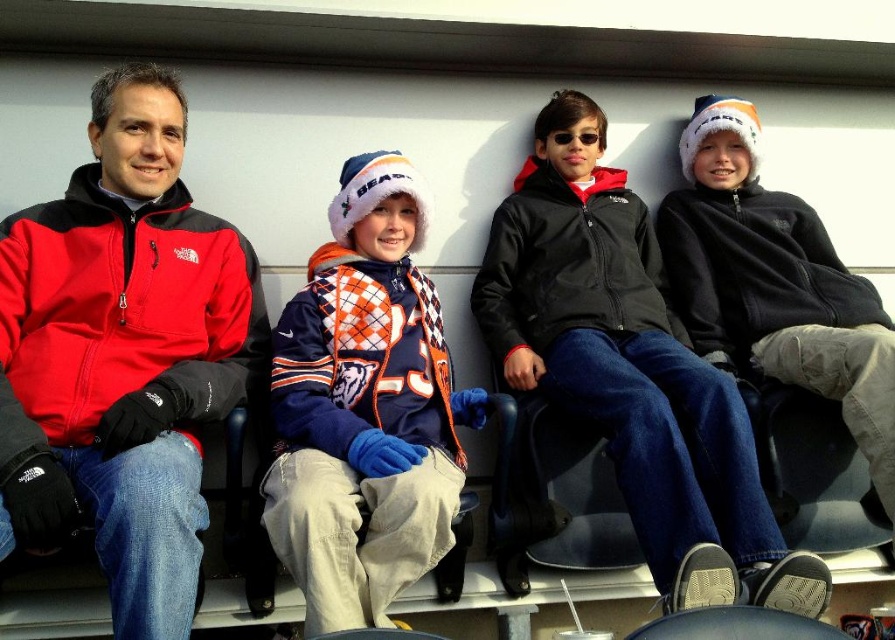
Question: Which point is farther to the camera?

Choices:
 (A) black fleece jacket at right
 (B) matte black jacket at left
 (C) orange and white argyle sweater at center
 (D) black fleece jacket at center

Answer: (A)

Question: Does black fleece jacket at center have a larger size compared to black fleece jacket at right?

Choices:
 (A) yes
 (B) no

Answer: (A)

Question: Where is matte black jacket at left located in relation to black fleece jacket at center in the image?

Choices:
 (A) right
 (B) left

Answer: (B)

Question: Which object is the closest to the black fleece jacket at center?

Choices:
 (A) black fleece jacket at right
 (B) orange and white argyle sweater at center

Answer: (A)

Question: Does orange and white argyle sweater at center appear on the right side of black fleece jacket at right?

Choices:
 (A) yes
 (B) no

Answer: (B)

Question: Which of the following is the farthest from the observer?

Choices:
 (A) black fleece jacket at right
 (B) black fleece jacket at center
 (C) matte black jacket at left

Answer: (A)